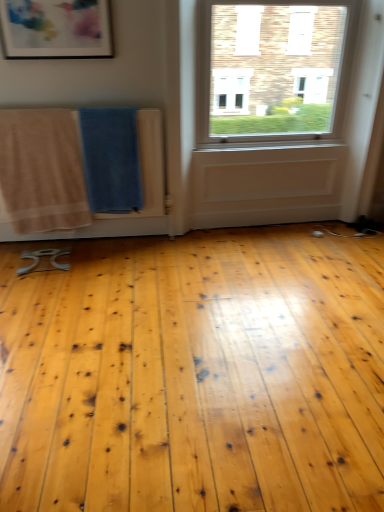
Question: Can you confirm if beige cotton towel at left, which is the 2th beach towel in right-to-left order, is positioned to the right of blue textured towel at center, positioned as the first beach towel in right-to-left order?

Choices:
 (A) yes
 (B) no

Answer: (B)

Question: Is beige cotton towel at left, which is the 1th beach towel in left-to-right order, positioned far away from blue textured towel at center, the 2th beach towel when ordered from left to right?

Choices:
 (A) yes
 (B) no

Answer: (B)

Question: Considering the relative sizes of beige cotton towel at left, which is the 2th beach towel in right-to-left order, and blue textured towel at center, positioned as the first beach towel in right-to-left order, in the image provided, is beige cotton towel at left, which is the 2th beach towel in right-to-left order, smaller than blue textured towel at center, positioned as the first beach towel in right-to-left order,?

Choices:
 (A) no
 (B) yes

Answer: (A)

Question: Can we say beige cotton towel at left, which is the 2th beach towel in right-to-left order, lies outside blue textured towel at center, positioned as the first beach towel in right-to-left order?

Choices:
 (A) no
 (B) yes

Answer: (B)

Question: Is blue textured towel at center, positioned as the first beach towel in right-to-left order, completely or partially inside beige cotton towel at left, which is the 2th beach towel in right-to-left order?

Choices:
 (A) no
 (B) yes

Answer: (A)

Question: Are beige cotton towel at left, which is the 1th beach towel in left-to-right order, and blue textured towel at center, the 2th beach towel when ordered from left to right, making contact?

Choices:
 (A) yes
 (B) no

Answer: (B)

Question: Could you tell me if matte plastic picture frame at upper left is turned towards blue textured towel at center, positioned as the first beach towel in right-to-left order?

Choices:
 (A) yes
 (B) no

Answer: (B)

Question: Does matte plastic picture frame at upper left have a greater height compared to blue textured towel at center, positioned as the first beach towel in right-to-left order?

Choices:
 (A) yes
 (B) no

Answer: (B)

Question: Would you say matte plastic picture frame at upper left is outside blue textured towel at center, the 2th beach towel when ordered from left to right?

Choices:
 (A) yes
 (B) no

Answer: (A)

Question: From a real-world perspective, is matte plastic picture frame at upper left beneath blue textured towel at center, positioned as the first beach towel in right-to-left order?

Choices:
 (A) yes
 (B) no

Answer: (B)

Question: Does matte plastic picture frame at upper left have a greater width compared to blue textured towel at center, positioned as the first beach towel in right-to-left order?

Choices:
 (A) yes
 (B) no

Answer: (B)

Question: Considering the relative positions of matte plastic picture frame at upper left and blue textured towel at center, positioned as the first beach towel in right-to-left order, in the image provided, is matte plastic picture frame at upper left to the left of blue textured towel at center, positioned as the first beach towel in right-to-left order, from the viewer's perspective?

Choices:
 (A) yes
 (B) no

Answer: (A)

Question: Can you confirm if beige cotton towel at left, which is the 1th beach towel in left-to-right order, is taller than matte plastic picture frame at upper left?

Choices:
 (A) no
 (B) yes

Answer: (B)